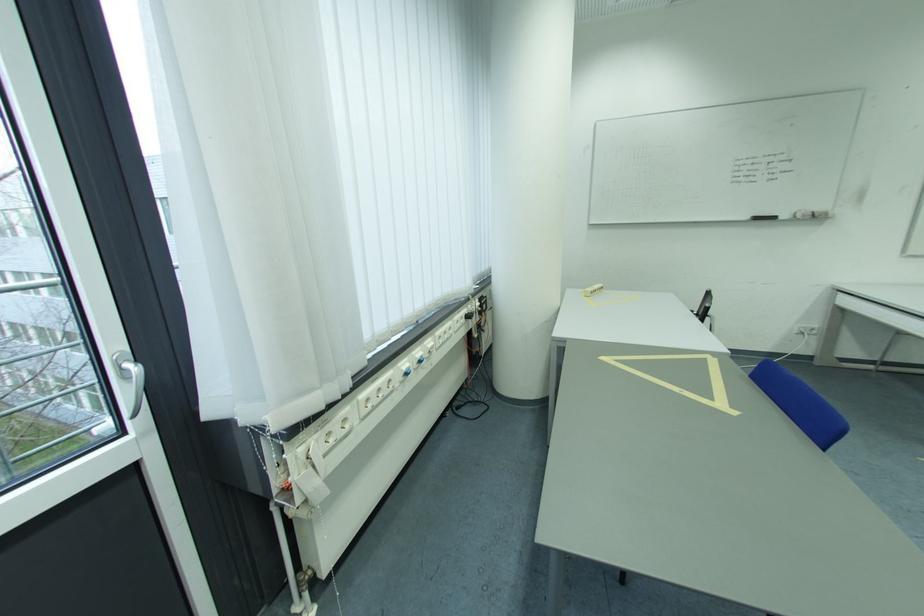
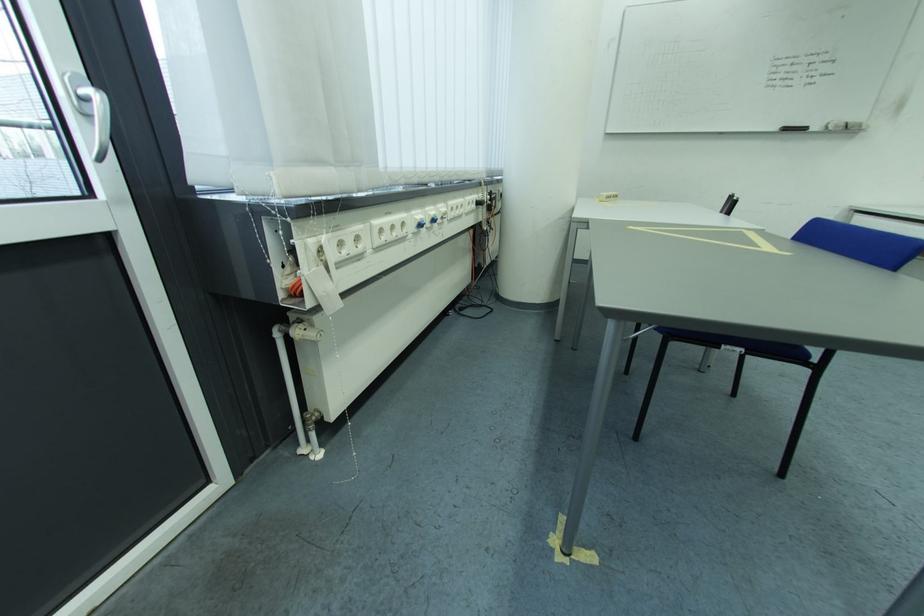
Question: The images are taken continuously from a first-person perspective. In which direction is your viewpoint rotating?

Choices:
 (A) Left
 (B) Right
 (C) Up
 (D) Down

Answer: (D)